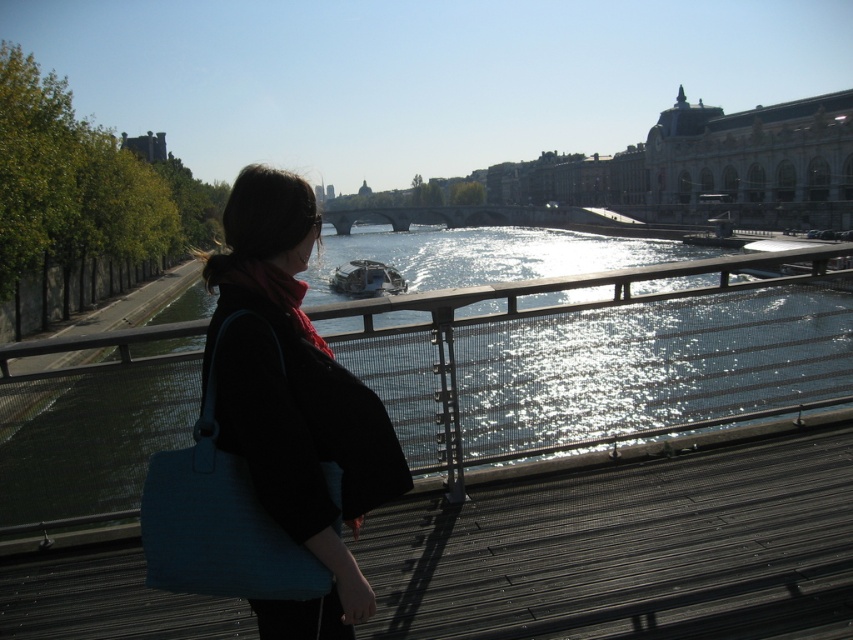
Question: Can you confirm if greenish water at center is positioned to the right of matte black jacket at center?

Choices:
 (A) yes
 (B) no

Answer: (A)

Question: Which point is farther from the camera taking this photo?

Choices:
 (A) (393, 212)
 (B) (643, 307)

Answer: (A)

Question: Which object is positioned closest to the matte black jacket at center?

Choices:
 (A) greenish water at center
 (B) stone bridge at center

Answer: (A)

Question: Which point is farther to the camera?

Choices:
 (A) matte black jacket at center
 (B) greenish water at center

Answer: (B)

Question: Observing the image, what is the correct spatial positioning of greenish water at center in reference to matte black jacket at center?

Choices:
 (A) above
 (B) below

Answer: (A)

Question: Can you confirm if greenish water at center is positioned to the right of matte black jacket at center?

Choices:
 (A) no
 (B) yes

Answer: (B)